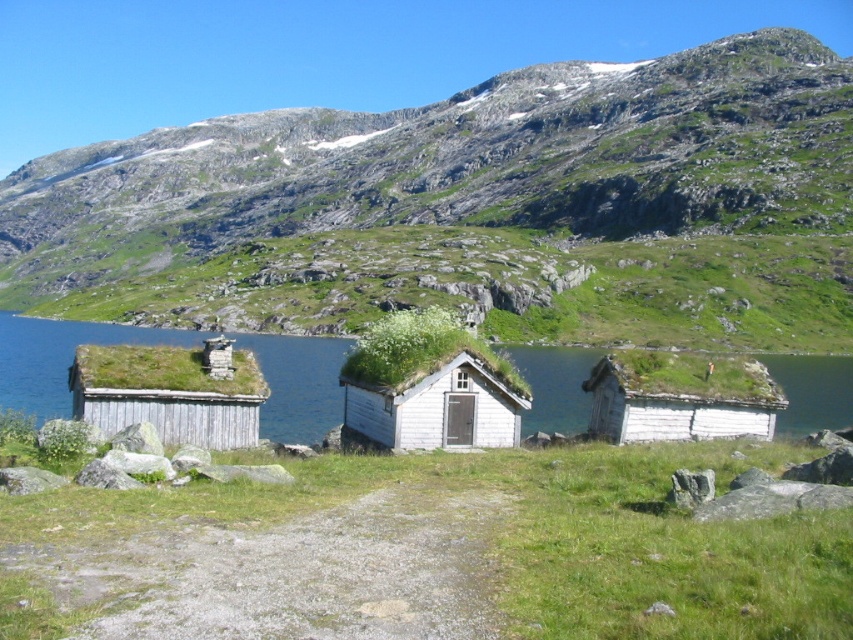
You are standing at the starting point of the dirt path leading to the cabins. You want to reach the blue water at center. Which direction should you walk to get there?

Since the blue water at center is located at coordinates point (59, 356), you should walk towards the center of the image to reach it.

You are standing at the edge of the dirt path leading to the cabins. You want to take a photo of both the blue water at center and the white wooden cottage at right. Which object should you point your camera towards first if you want to capture both in the same frame?

You should point your camera towards the blue water at center first because it is above the white wooden cottage at right, so adjusting the angle to include both would require framing from the top down.